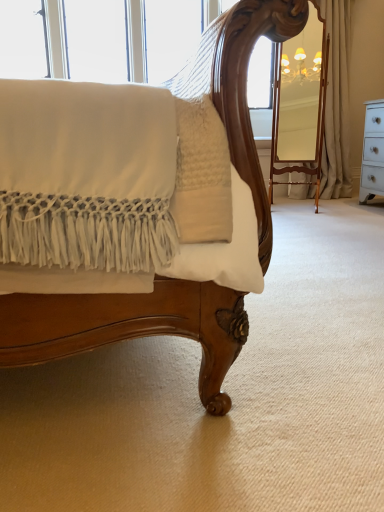
Question: Could you tell me if beige fabric curtain at right, marked as the first curtain in a right-to-left arrangement, is turned towards beige fabric curtain at upper right, the 1th curtain positioned from the left?

Choices:
 (A) yes
 (B) no

Answer: (B)

Question: Can you see beige fabric curtain at right, marked as the first curtain in a right-to-left arrangement, touching beige fabric curtain at upper right, the second curtain when ordered from right to left?

Choices:
 (A) no
 (B) yes

Answer: (B)

Question: From a real-world perspective, does beige fabric curtain at right, the second curtain when ordered from left to right, stand above beige fabric curtain at upper right, the second curtain when ordered from right to left?

Choices:
 (A) yes
 (B) no

Answer: (A)

Question: Considering the relative sizes of beige fabric curtain at right, the second curtain when ordered from left to right, and beige fabric curtain at upper right, the 1th curtain positioned from the left, in the image provided, is beige fabric curtain at right, the second curtain when ordered from left to right, smaller than beige fabric curtain at upper right, the 1th curtain positioned from the left,?

Choices:
 (A) no
 (B) yes

Answer: (B)

Question: Is beige fabric curtain at right, the second curtain when ordered from left to right, turned away from beige fabric curtain at upper right, the second curtain when ordered from right to left?

Choices:
 (A) yes
 (B) no

Answer: (B)

Question: Is beige fabric curtain at right, marked as the first curtain in a right-to-left arrangement, shorter than beige fabric curtain at upper right, the 1th curtain positioned from the left?

Choices:
 (A) yes
 (B) no

Answer: (B)

Question: Considering the relative positions of beige fabric curtain at upper right, the 1th curtain positioned from the left, and beige fabric curtain at right, marked as the first curtain in a right-to-left arrangement, in the image provided, is beige fabric curtain at upper right, the 1th curtain positioned from the left, to the right of beige fabric curtain at right, marked as the first curtain in a right-to-left arrangement, from the viewer's perspective?

Choices:
 (A) yes
 (B) no

Answer: (B)

Question: From a real-world perspective, is beige fabric curtain at upper right, the 1th curtain positioned from the left, located higher than beige fabric curtain at right, the second curtain when ordered from left to right?

Choices:
 (A) no
 (B) yes

Answer: (A)

Question: Are beige fabric curtain at upper right, the 1th curtain positioned from the left, and beige fabric curtain at right, the second curtain when ordered from left to right, located far from each other?

Choices:
 (A) yes
 (B) no

Answer: (B)

Question: Is beige fabric curtain at upper right, the second curtain when ordered from right to left, looking in the opposite direction of beige fabric curtain at right, the second curtain when ordered from left to right?

Choices:
 (A) no
 (B) yes

Answer: (A)

Question: Is beige fabric curtain at upper right, the 1th curtain positioned from the left, smaller than beige fabric curtain at right, marked as the first curtain in a right-to-left arrangement?

Choices:
 (A) yes
 (B) no

Answer: (B)

Question: Is the position of beige fabric curtain at upper right, the 1th curtain positioned from the left, more distant than that of beige fabric curtain at right, the second curtain when ordered from left to right?

Choices:
 (A) yes
 (B) no

Answer: (B)

Question: Which is correct: beige fabric curtain at right, marked as the first curtain in a right-to-left arrangement, is inside beige fabric curtain at upper right, the 1th curtain positioned from the left, or outside of it?

Choices:
 (A) outside
 (B) inside

Answer: (A)